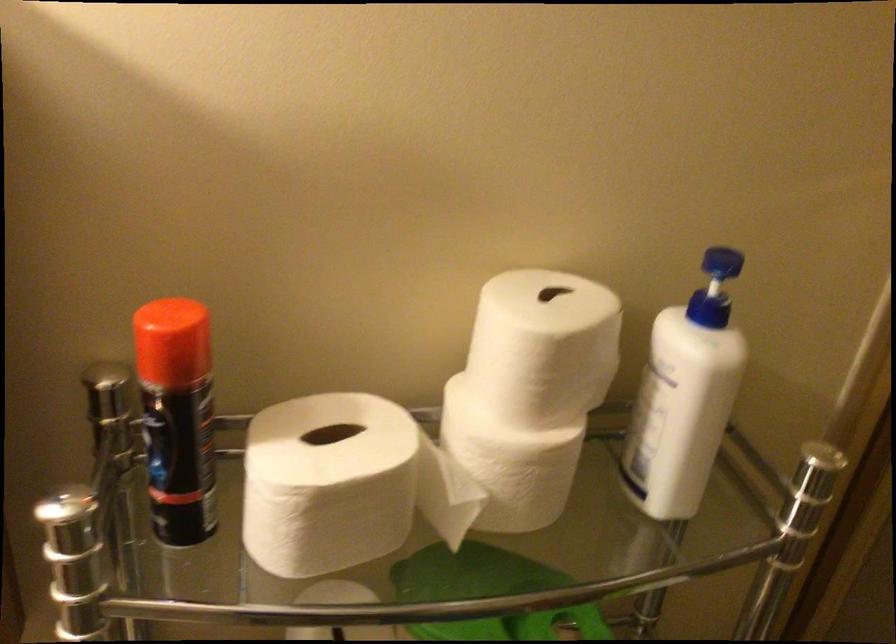
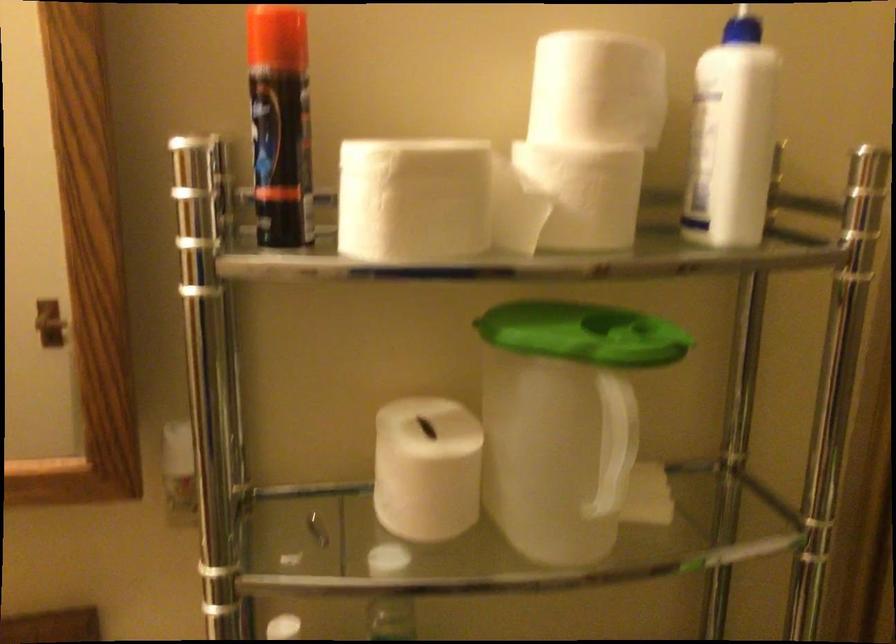
Locate, in the second image, the point that corresponds to point 546,363 in the first image.

(597, 89)